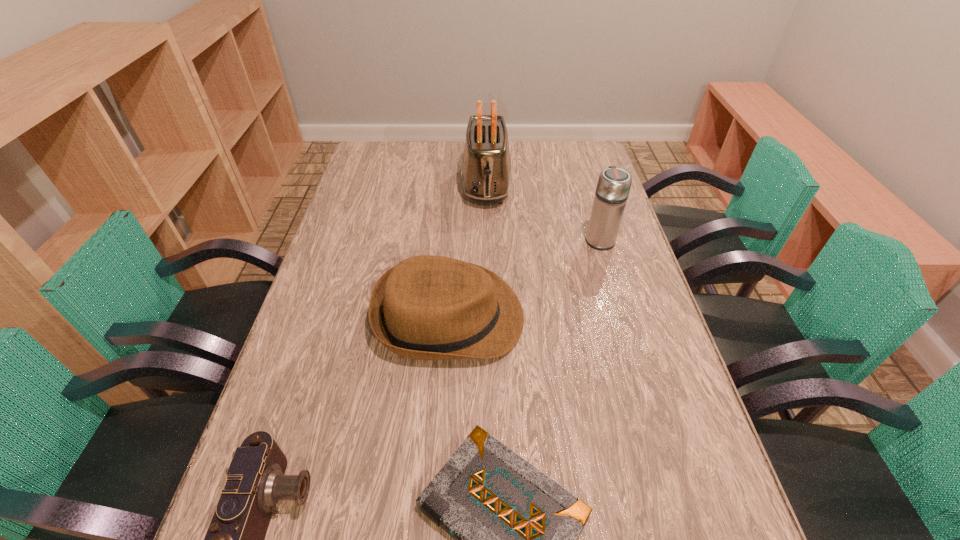
Select which object appears as the second closest to the farthest object. Please provide its 2D coordinates. Your answer should be formatted as a tuple, i.e. [(x, y)], where the tuple contains the x and y coordinates of a point satisfying the conditions above.

[(427, 307)]

In order to click on object identified as the closest to the leftmost object in this screenshot , I will do `click(515, 529)`.